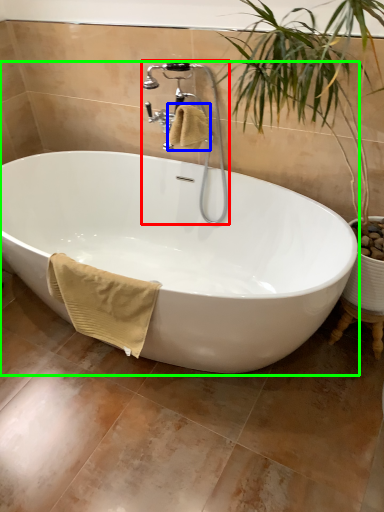
Question: Considering the real-world distances, which object is closest to faucet (highlighted by a red box)? bath towel (highlighted by a blue box) or bathtub (highlighted by a green box).

Choices:
 (A) bath towel
 (B) bathtub

Answer: (A)